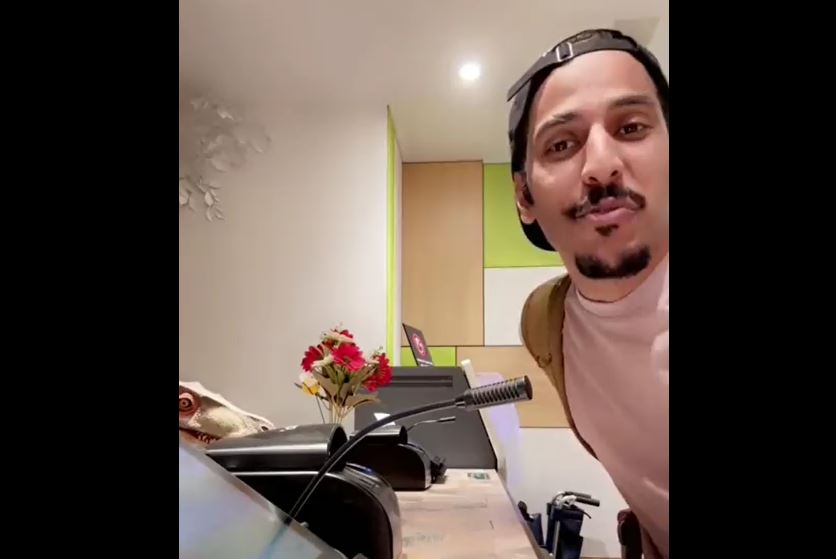
I want to click on printer, so click(x=379, y=519).